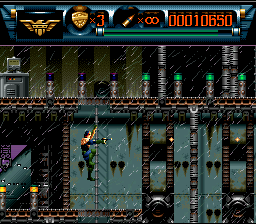
Identify the location of green light. (x=145, y=76), (x=176, y=76), (x=215, y=80), (x=243, y=77).